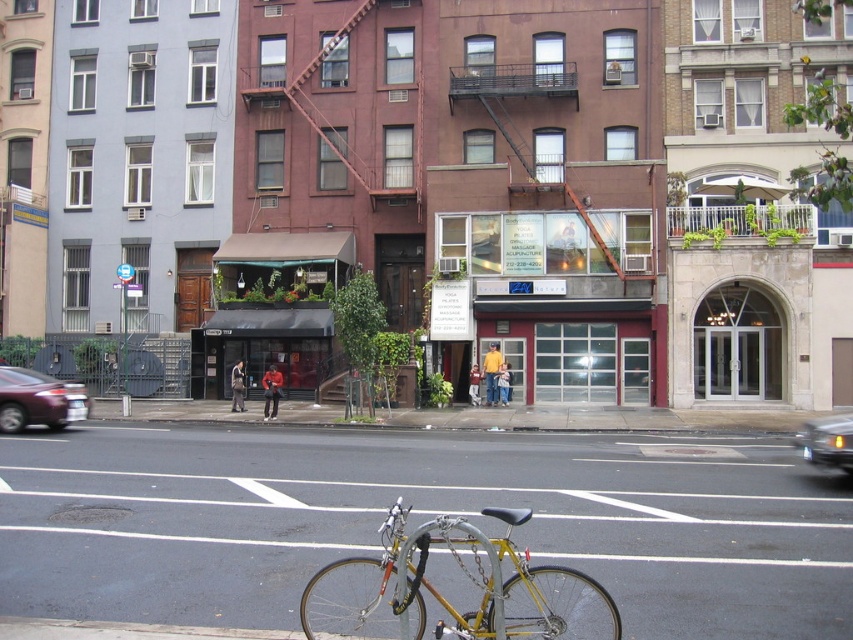
Question: Which point appears farthest from the camera in this image?

Choices:
 (A) (6, 432)
 (B) (399, 596)

Answer: (A)

Question: Does gold metallic bicycle at center appear over matte black sedan at left?

Choices:
 (A) yes
 (B) no

Answer: (B)

Question: Does gold metallic bicycle at center appear over matte black sedan at left?

Choices:
 (A) no
 (B) yes

Answer: (A)

Question: Does gold metallic bicycle at center appear over metallic silver car at center right?

Choices:
 (A) yes
 (B) no

Answer: (A)

Question: Based on their relative distances, which object is farther from the matte black sedan at left?

Choices:
 (A) gold metallic bicycle at center
 (B) metallic silver car at center right

Answer: (A)

Question: Based on their relative distances, which object is nearer to the matte black sedan at left?

Choices:
 (A) gold metallic bicycle at center
 (B) metallic silver car at center right

Answer: (B)